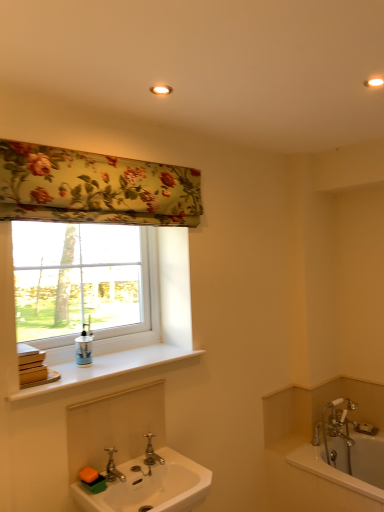
Where is `vacant space situated on the left part of matte white recessed light at upper center`? vacant space situated on the left part of matte white recessed light at upper center is located at coordinates (115, 92).